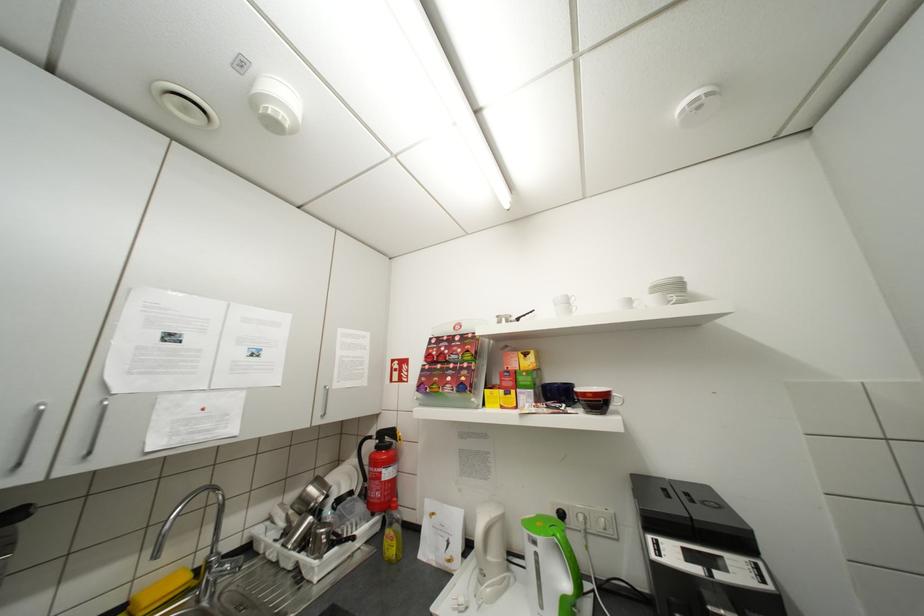
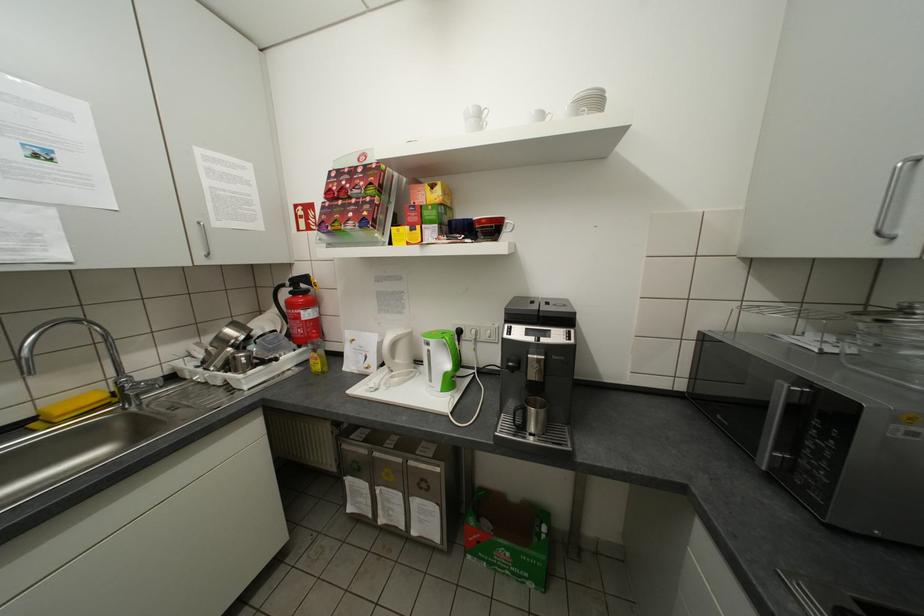
Locate, in the second image, the point that corresponds to pixel 563 536 in the first image.

(452, 338)